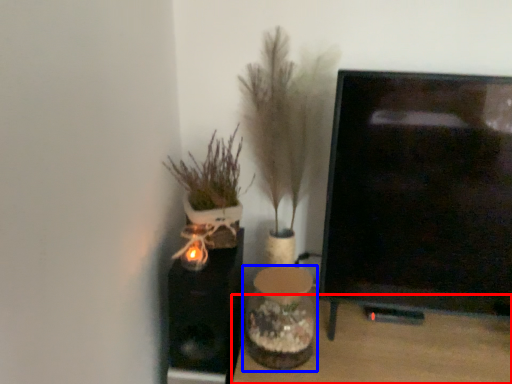
Question: Which object appears farthest to the camera in this image, furniture (highlighted by a red box) or vase (highlighted by a blue box)?

Choices:
 (A) furniture
 (B) vase

Answer: (B)